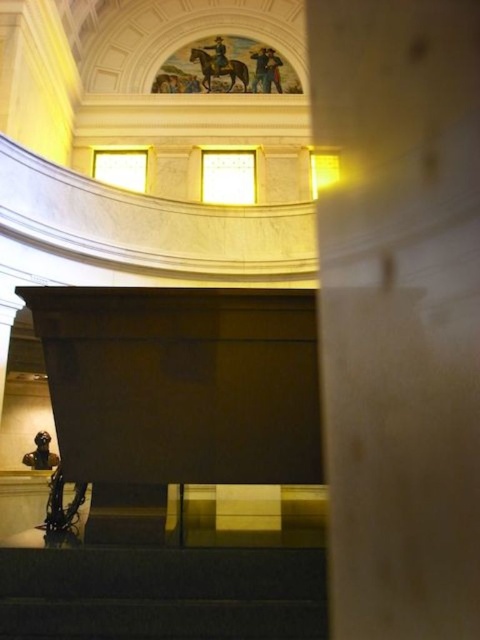
You are an architect visiting this historical building and need to install a new light fixture between the white marble pillar at center and the light brown leather horse at upper center. Based on their positions, where should you place the fixture?

The white marble pillar at center is below the light brown leather horse at upper center, so the light fixture should be placed between them, closer to the pillar since it is lower in position.

You are an art student observing the mural at the top of the staircase. In the scene depicted, which object is placed above the other between the dark blue uniform at upper center and the light brown leather horse at upper center?

The light brown leather horse at upper center is placed above the dark blue uniform at upper center, as the dark blue uniform at upper center is positioned under it.